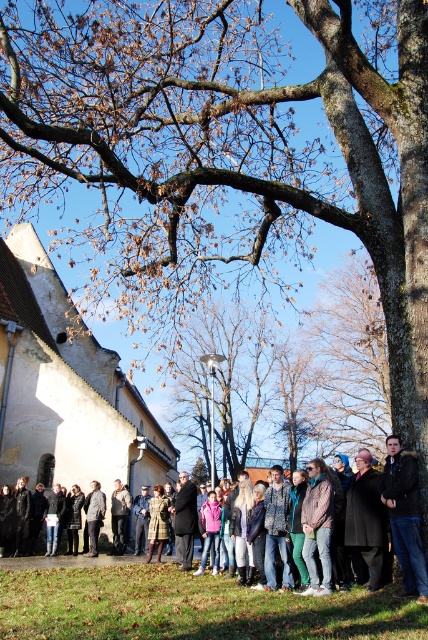
Question: Is white stucco church at left closer to camera compared to brown rough tree at center?

Choices:
 (A) no
 (B) yes

Answer: (B)

Question: Based on their relative distances, which object is nearer to the dark brown leather jacket at lower right?

Choices:
 (A) dark gray jacket at center
 (B) denim jacket at center
 (C) white stucco church at left
 (D) dark gray wool coat at lower right

Answer: (D)

Question: Where is white stucco church at left located in relation to brown rough tree at center in the image?

Choices:
 (A) left
 (B) right

Answer: (A)

Question: Which point appears farthest from the camera in this image?

Choices:
 (A) (306, 502)
 (B) (380, 589)
 (C) (101, 515)

Answer: (C)

Question: Is brown rough tree at center closer to camera compared to dark gray jacket at center?

Choices:
 (A) yes
 (B) no

Answer: (B)

Question: Which of the following is the farthest from the observer?

Choices:
 (A) dark gray wool coat at lower right
 (B) dark gray jacket at center
 (C) dark gray fabric jacket at center
 (D) denim jacket at center

Answer: (B)